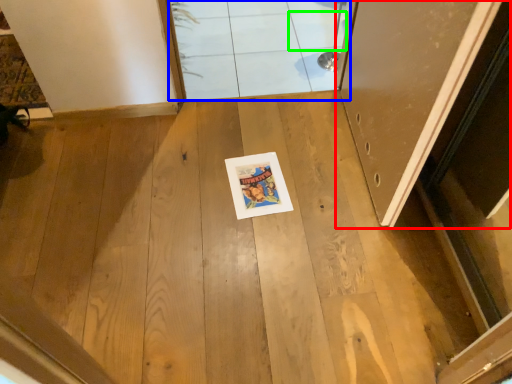
Question: Considering the real-world distances, which object is farthest from door (highlighted by a red box)? window (highlighted by a blue box) or tile (highlighted by a green box)?

Choices:
 (A) window
 (B) tile

Answer: (B)